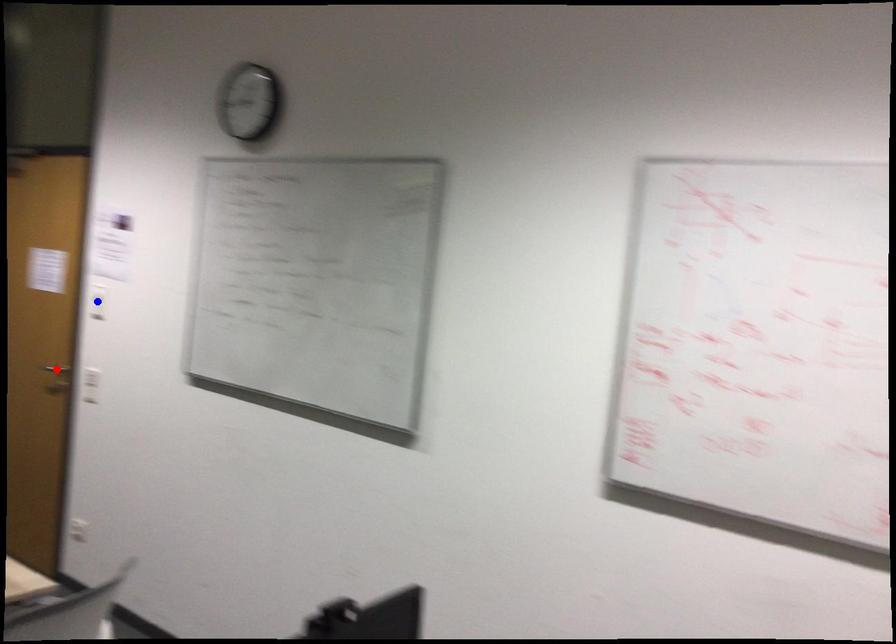
Question: Which of the two points in the image is closer to the camera?

Choices:
 (A) Blue point is closer.
 (B) Red point is closer.

Answer: (A)